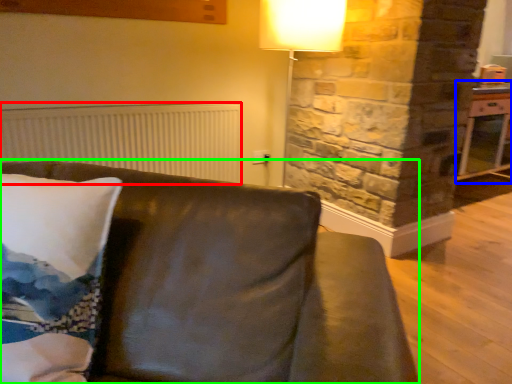
Question: Which object is the farthest from radiator (highlighted by a red box)? Choose among these: table (highlighted by a blue box) or studio couch (highlighted by a green box).

Choices:
 (A) table
 (B) studio couch

Answer: (A)